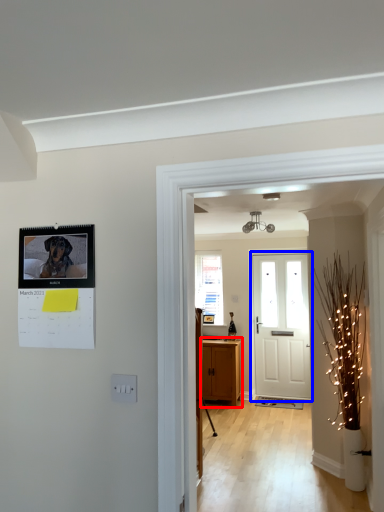
Question: Which point is closer to the camera, cabinetry (highlighted by a red box) or door (highlighted by a blue box)?

Choices:
 (A) cabinetry
 (B) door

Answer: (A)